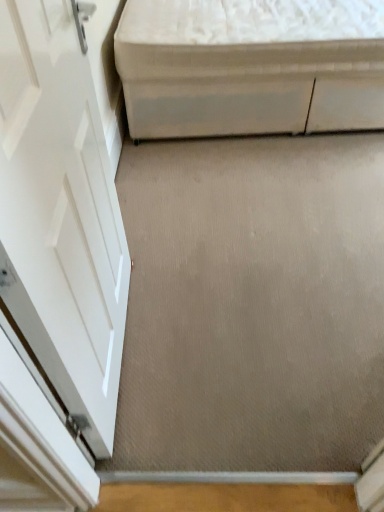
The height and width of the screenshot is (512, 384). I want to click on beige carpet at center, so click(252, 304).

Measure the distance between beige carpet at center and camera.

The distance of beige carpet at center from camera is 1.22 meters.

What do you see at coordinates (252, 304) in the screenshot? I see `beige carpet at center` at bounding box center [252, 304].

In order to face white fabric ottoman at upper right, should I rotate leftwards or rightwards?

To align with it, rotate right about 11.540°.

In order to click on white fabric ottoman at upper right in this screenshot , I will do `click(250, 66)`.

Image resolution: width=384 pixels, height=512 pixels. What do you see at coordinates (250, 66) in the screenshot? I see `white fabric ottoman at upper right` at bounding box center [250, 66].

I want to click on beige carpet at center, so click(x=252, y=304).

Between beige carpet at center and white fabric ottoman at upper right, which one appears on the left side from the viewer's perspective?

beige carpet at center.

In the image, is beige carpet at center positioned in front of or behind white fabric ottoman at upper right?

beige carpet at center is in front of white fabric ottoman at upper right.

Which is in front, point (381, 373) or point (353, 11)?

The point (381, 373) is closer to the camera.

From the image's perspective, which one is positioned lower, beige carpet at center or white fabric ottoman at upper right?

beige carpet at center.

From a real-world perspective, is beige carpet at center over white fabric ottoman at upper right?

No, from a real-world perspective, beige carpet at center is not on top of white fabric ottoman at upper right.

Can you confirm if beige carpet at center is wider than white fabric ottoman at upper right?

No.

Who is taller, beige carpet at center or white fabric ottoman at upper right?

With more height is white fabric ottoman at upper right.

Who is smaller, beige carpet at center or white fabric ottoman at upper right?

beige carpet at center.

Is beige carpet at center outside of white fabric ottoman at upper right?

beige carpet at center is positioned outside white fabric ottoman at upper right.

Is there a large distance between beige carpet at center and white fabric ottoman at upper right?

They are positioned close to each other.

Could you tell me if beige carpet at center is facing white fabric ottoman at upper right?

No, beige carpet at center does not turn towards white fabric ottoman at upper right.

Can you tell me how much beige carpet at center and white fabric ottoman at upper right differ in facing direction?

The angular difference between beige carpet at center and white fabric ottoman at upper right is 91.9 degrees.

Where is `concrete that is in front of the white fabric ottoman at upper right`? concrete that is in front of the white fabric ottoman at upper right is located at coordinates (252, 304).

From the picture: Considering the relative positions of white fabric ottoman at upper right and beige carpet at center in the image provided, is white fabric ottoman at upper right to the right of beige carpet at center from the viewer's perspective?

Indeed, white fabric ottoman at upper right is positioned on the right side of beige carpet at center.

Does white fabric ottoman at upper right come in front of beige carpet at center?

That is False.

Does point (296, 54) lie in front of point (355, 314)?

No, (296, 54) is further to viewer.

Based on the photo, from the image's perspective, is white fabric ottoman at upper right over beige carpet at center?

Yes.

From a real-world perspective, is white fabric ottoman at upper right beneath beige carpet at center?

No, from a real-world perspective, white fabric ottoman at upper right is not beneath beige carpet at center.

Is white fabric ottoman at upper right wider or thinner than beige carpet at center?

Considering their sizes, white fabric ottoman at upper right looks broader than beige carpet at center.

Considering the sizes of objects white fabric ottoman at upper right and beige carpet at center in the image provided, who is shorter, white fabric ottoman at upper right or beige carpet at center?

Standing shorter between the two is beige carpet at center.

Considering the sizes of objects white fabric ottoman at upper right and beige carpet at center in the image provided, who is smaller, white fabric ottoman at upper right or beige carpet at center?

beige carpet at center is smaller.

Is white fabric ottoman at upper right outside of beige carpet at center?

Yes, white fabric ottoman at upper right is located beyond the bounds of beige carpet at center.

Would you say white fabric ottoman at upper right is a long distance from beige carpet at center?

No, white fabric ottoman at upper right is not far away from beige carpet at center.

Based on the photo, is white fabric ottoman at upper right facing away from beige carpet at center?

That's not correct — white fabric ottoman at upper right is not looking away from beige carpet at center.

Can you tell me how much white fabric ottoman at upper right and beige carpet at center differ in facing direction?

white fabric ottoman at upper right and beige carpet at center are facing 91.9 degrees away from each other.

In order to click on furniture located behind the beige carpet at center in this screenshot , I will do `click(250, 66)`.

The height and width of the screenshot is (512, 384). In order to click on furniture that appears above the beige carpet at center (from the image's perspective) in this screenshot , I will do `click(250, 66)`.

The image size is (384, 512). What are the coordinates of `concrete in front of the white fabric ottoman at upper right` in the screenshot? It's located at (252, 304).